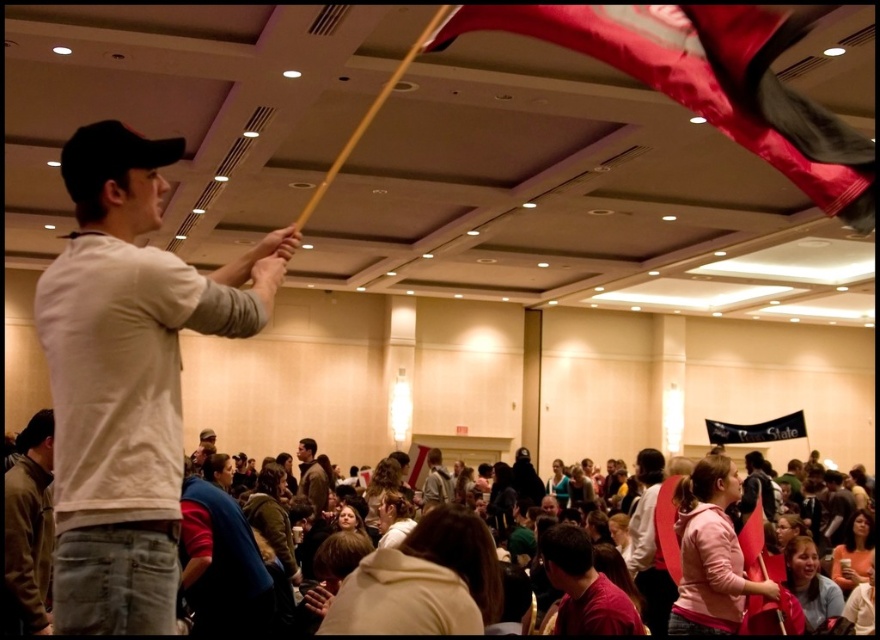
You are standing at the point marked as point (174, 371) and want to take a photo of the ceiling fixtures. The camera you have can focus on objects up to 2.5 meters away. Will you be able to capture the ceiling fixtures clearly with this camera?

The distance between point (174, 371) and the camera is 2.34 meters, which is within the camera focus range of 2.5 meters. Therefore, you can capture the ceiling fixtures clearly.

Consider the image. You are standing in the conference hall and see two points marked on the ceiling. The first point is at coordinates point (737,118) and the second point is at point (738,428). Which point is closer to you?

→ Point (737,118) is closer to the viewer than point (738,428).